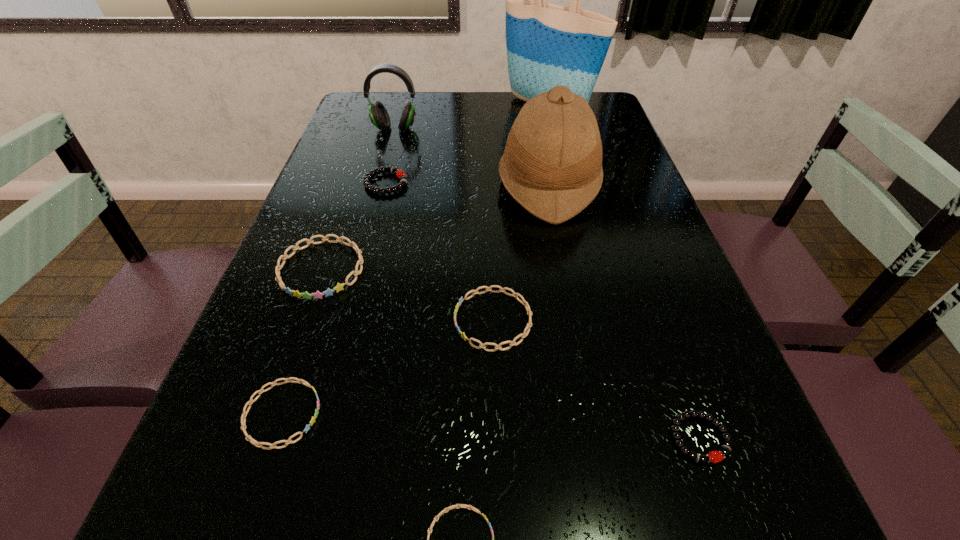
Where is `blue tote bag`? The image size is (960, 540). blue tote bag is located at coordinates (548, 45).

This screenshot has width=960, height=540. What are the coordinates of `the tallest object` in the screenshot? It's located at (548, 45).

At what (x,y) coordinates should I click in order to perform the action: click on the eighth shortest object. Please return your answer as a coordinate pair (x, y). This screenshot has height=540, width=960. Looking at the image, I should click on (552, 163).

This screenshot has width=960, height=540. I want to click on black headset, so click(378, 114).

Locate an element on the screen. The width and height of the screenshot is (960, 540). headset is located at coordinates (378, 114).

At what (x,y) coordinates should I click in order to perform the action: click on the tallest bracelet. Please return your answer as a coordinate pair (x, y). Looking at the image, I should click on (339, 286).

Identify the location of the biggest blue bracelet. Image resolution: width=960 pixels, height=540 pixels. (339, 286).

Where is `the second biggest blue bracelet`? Image resolution: width=960 pixels, height=540 pixels. the second biggest blue bracelet is located at coordinates point(529,312).

The image size is (960, 540). In order to click on the farthest bracelet in this screenshot , I will do `click(400, 174)`.

Where is `the left black bracelet`? the left black bracelet is located at coordinates (400, 174).